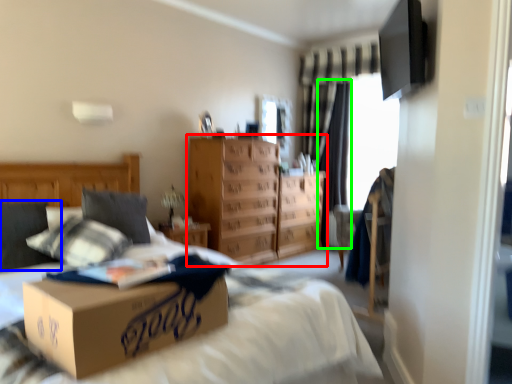
Question: Based on their relative distances, which object is nearer to chest of drawers (highlighted by a red box)? Choose from pillow (highlighted by a blue box) and curtain (highlighted by a green box).

Choices:
 (A) pillow
 (B) curtain

Answer: (B)